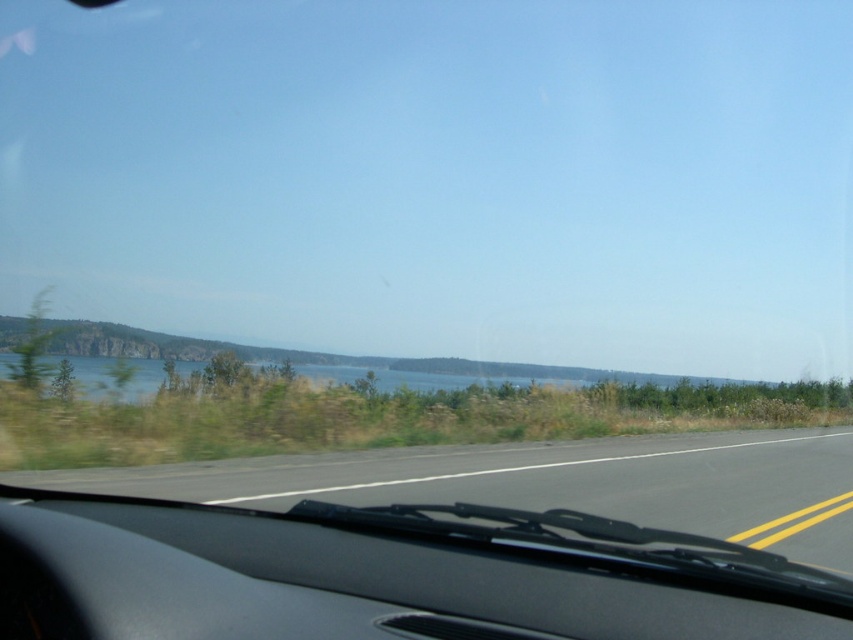
Question: Which point is farther to the camera?

Choices:
 (A) black asphalt road at center
 (B) black matte dashboard at center

Answer: (A)

Question: Is black matte dashboard at center smaller than black asphalt road at center?

Choices:
 (A) yes
 (B) no

Answer: (A)

Question: Is black matte dashboard at center in front of black asphalt road at center?

Choices:
 (A) yes
 (B) no

Answer: (A)

Question: In this image, where is black matte dashboard at center located relative to black asphalt road at center?

Choices:
 (A) right
 (B) left

Answer: (B)

Question: Which of the following is the closest to the observer?

Choices:
 (A) black matte dashboard at center
 (B) black asphalt road at center

Answer: (A)

Question: Which point is closer to the camera?

Choices:
 (A) (572, 609)
 (B) (482, 456)

Answer: (A)